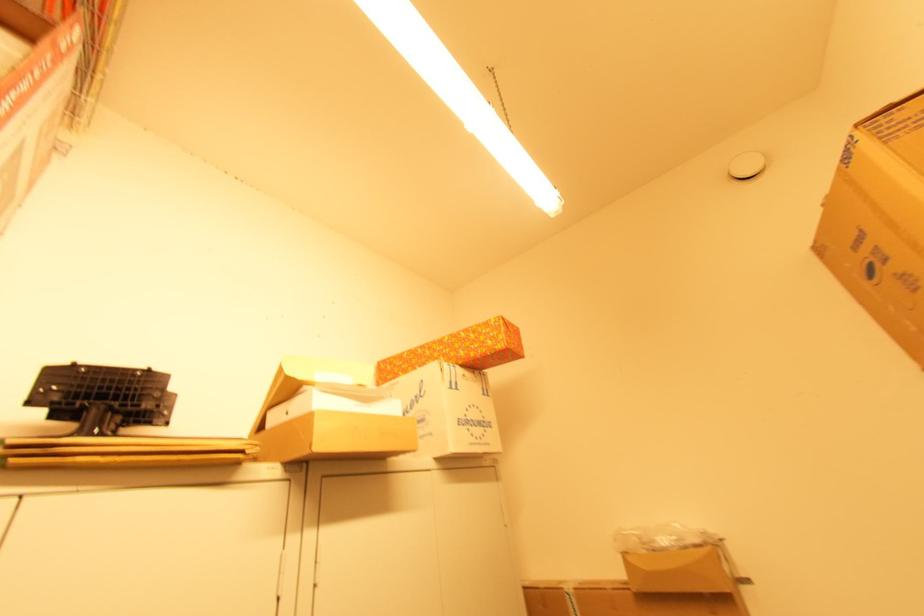
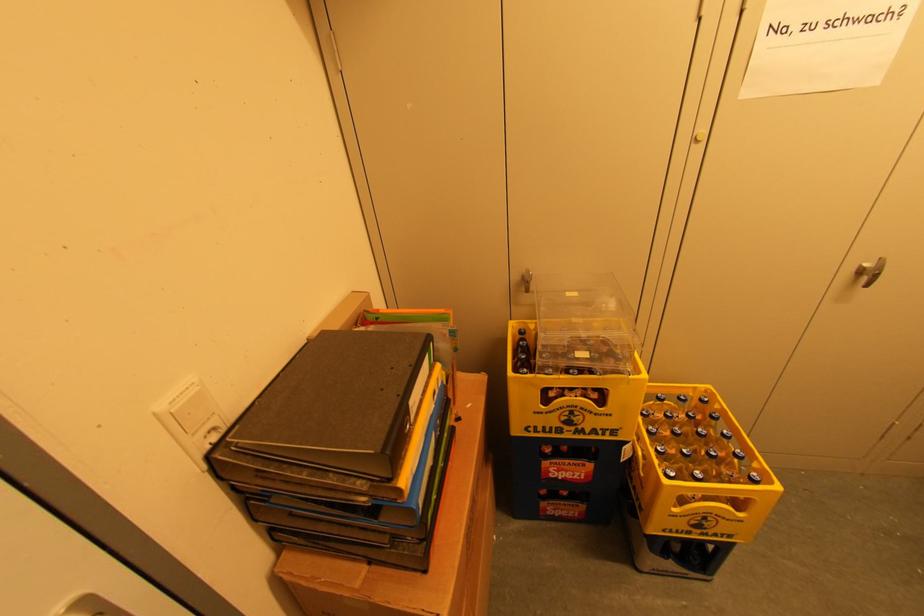
Looking at this image, the first image is from the beginning of the video and the second image is from the end. How did the camera likely rotate when shooting the video?

The camera rotated toward left-down.